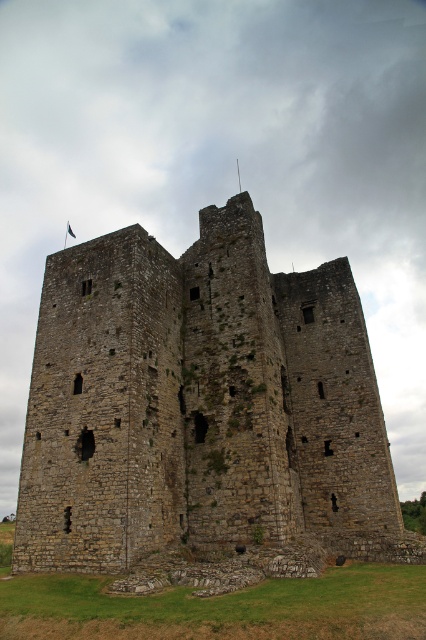
Question: Is brown stone castle at center positioned behind black fabric flag at upper center?

Choices:
 (A) yes
 (B) no

Answer: (B)

Question: Among these points, which one is nearest to the camera?

Choices:
 (A) [x=112, y=524]
 (B) [x=69, y=234]

Answer: (A)

Question: Which point appears closest to the camera in this image?

Choices:
 (A) (66, 227)
 (B) (227, 212)

Answer: (B)

Question: Can you confirm if brown stone castle at center is thinner than black fabric flag at upper center?

Choices:
 (A) no
 (B) yes

Answer: (A)

Question: Is brown stone castle at center bigger than black fabric flag at upper center?

Choices:
 (A) no
 (B) yes

Answer: (B)